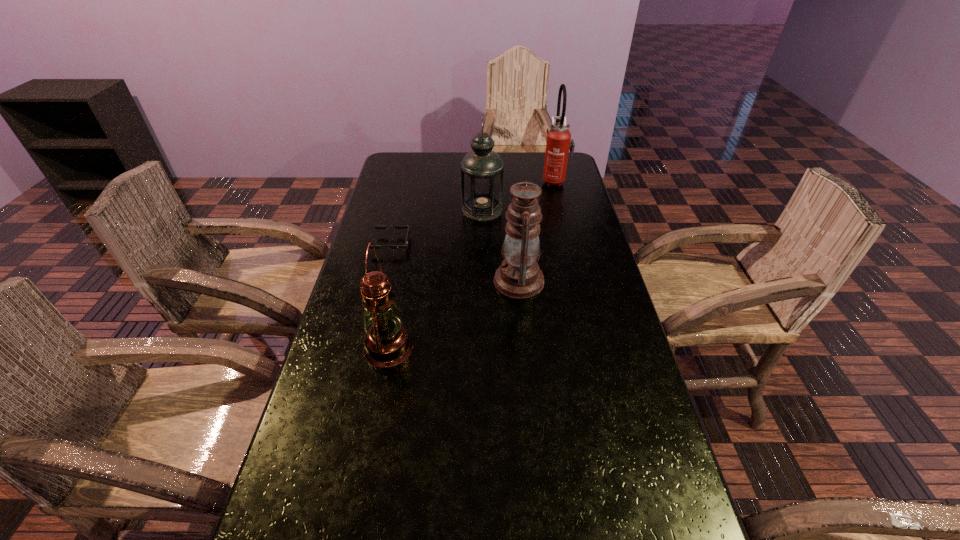
Where is `the rightmost object`? the rightmost object is located at coordinates (559, 141).

Where is `fire extinguisher`? fire extinguisher is located at coordinates (559, 141).

You are a GUI agent. You are given a task and a screenshot of the screen. Output one action in this format:
    pyautogui.click(x=<x>, y=<y>)
    Task: Click on the fourth nearest object
    The width and height of the screenshot is (960, 540).
    Given the screenshot: What is the action you would take?
    [x=482, y=169]

Locate an element on the screen. The width and height of the screenshot is (960, 540). the second farthest oil lamp is located at coordinates (519, 277).

Where is `the nearest object`? the nearest object is located at coordinates (387, 343).

The height and width of the screenshot is (540, 960). I want to click on the nearest oil lamp, so click(387, 343).

This screenshot has height=540, width=960. What are the coordinates of `the third farthest object` in the screenshot? It's located at pos(405,246).

Find the location of a particular element. This screenshot has width=960, height=540. sunglasses is located at coordinates (405, 246).

This screenshot has width=960, height=540. Identify the location of blank area located at the nozzle of the rightmost object. (526, 180).

In order to click on blank space located 0.070m at the nozzle of the rightmost object in this screenshot , I will do `click(524, 180)`.